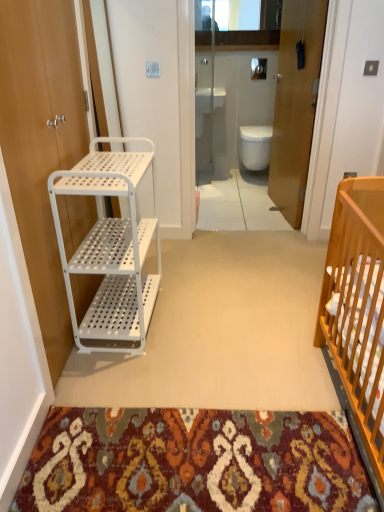
You are a GUI agent. You are given a task and a screenshot of the screen. Output one action in this format:
    pyautogui.click(x=<x>, y=<y>)
    Task: Click on the free spot to the right of white perforated shelving unit at left
    Image resolution: width=384 pixels, height=512 pixels.
    Given the screenshot: What is the action you would take?
    pyautogui.click(x=200, y=317)